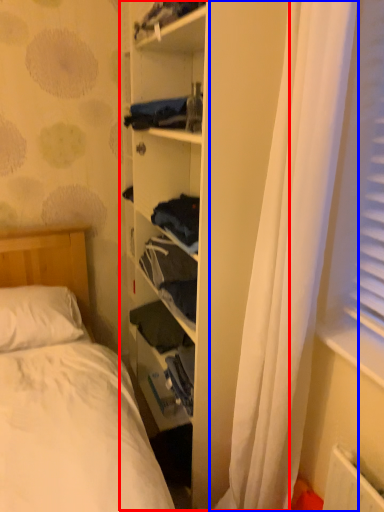
Question: Among these objects, which one is farthest to the camera, bookshelf (highlighted by a red box) or curtain (highlighted by a blue box)?

Choices:
 (A) bookshelf
 (B) curtain

Answer: (A)